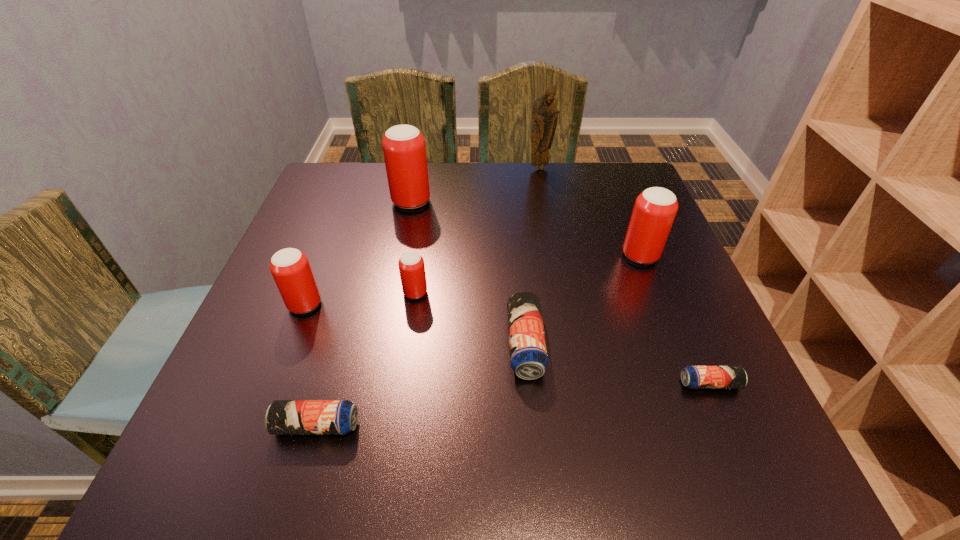
Find the location of `the closest blue beer can relative to the second smallest blue beer can`. the closest blue beer can relative to the second smallest blue beer can is located at coordinates (528, 355).

Locate which blue beer can ranks third in proximity to the fifth shortest beer can. Please provide its 2D coordinates. Your answer should be formatted as a tuple, i.e. [(x, y)], where the tuple contains the x and y coordinates of a point satisfying the conditions above.

[(694, 377)]

This screenshot has height=540, width=960. What are the coordinates of `vacant space that satisfies the following two spatial constraints: 1. on the front-facing side of the sixth shortest beer can; 2. on the left side of the tallest object` in the screenshot? It's located at (556, 256).